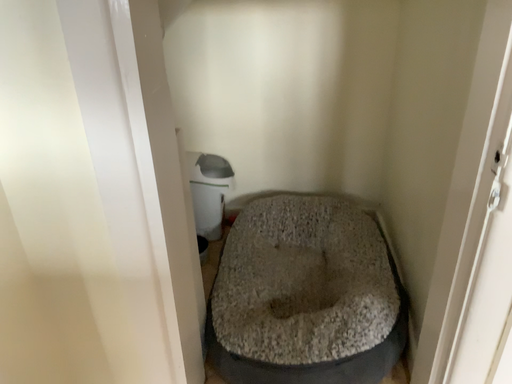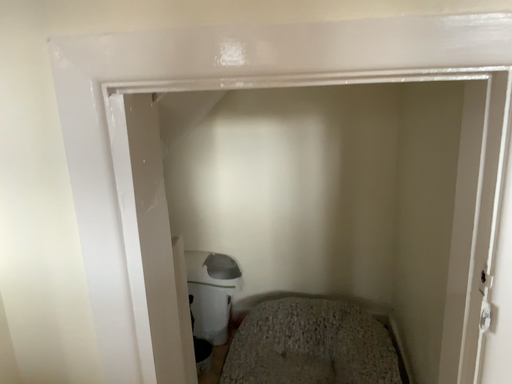
Question: Which way did the camera rotate in the video?

Choices:
 (A) rotated downward
 (B) rotated upward

Answer: (B)